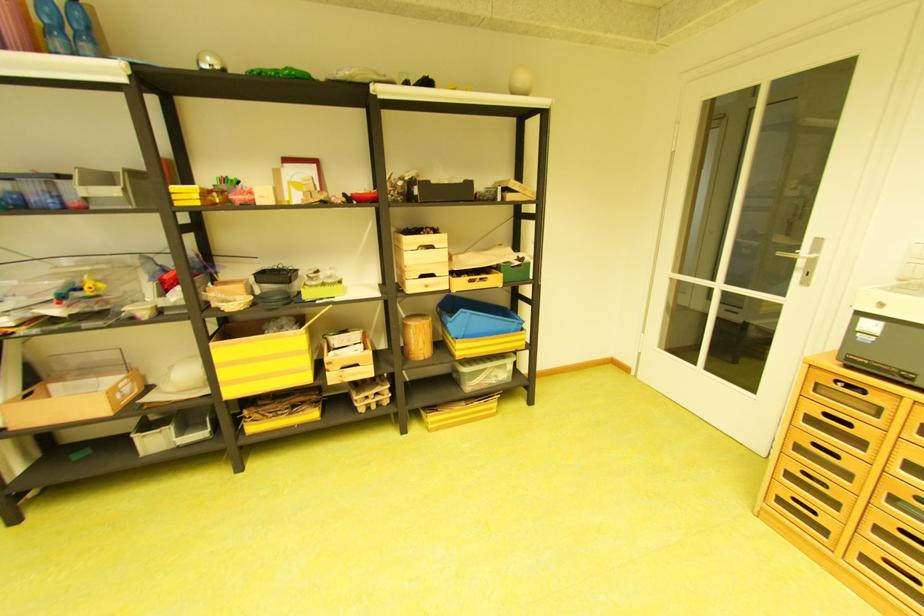
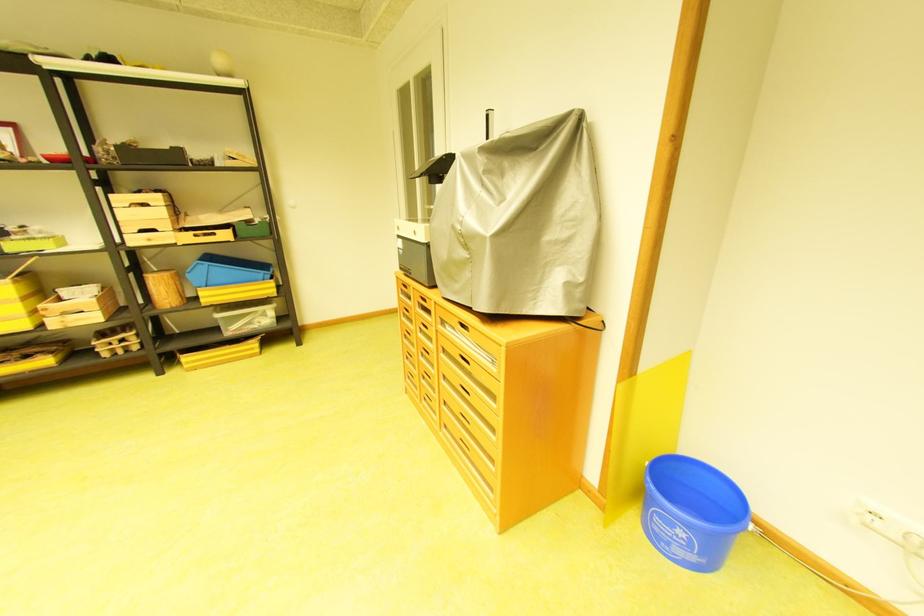
Which direction would the cameraman need to move to produce the second image?

The cameraman moved toward right, backward.